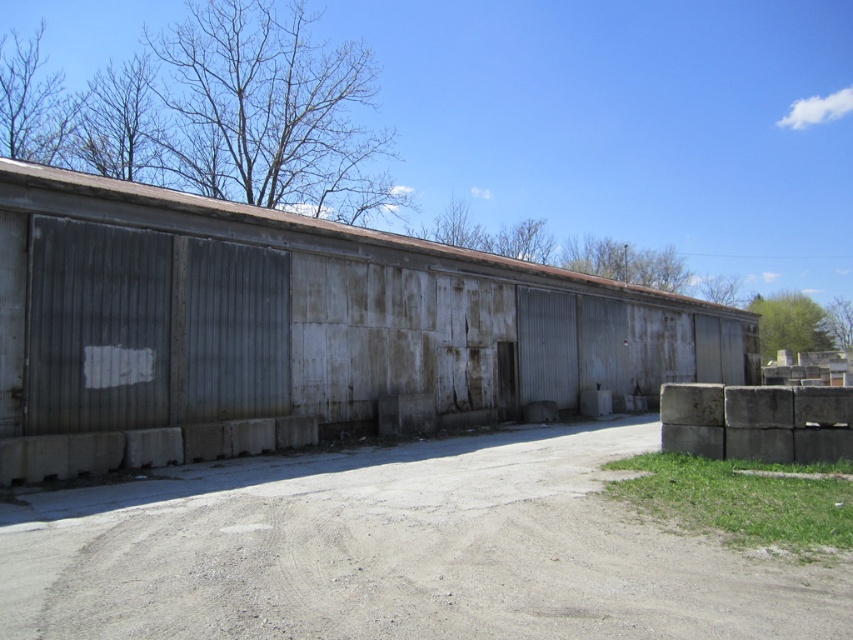
Question: Does rusty corrugated metal shed at center have a smaller size compared to gray gravel dirt track at center?

Choices:
 (A) no
 (B) yes

Answer: (A)

Question: Can you confirm if rusty corrugated metal shed at center is positioned below gray gravel dirt track at center?

Choices:
 (A) no
 (B) yes

Answer: (A)

Question: Is rusty corrugated metal shed at center further to camera compared to gray gravel dirt track at center?

Choices:
 (A) yes
 (B) no

Answer: (A)

Question: Which of the following is the closest to the observer?

Choices:
 (A) rusty corrugated metal shed at center
 (B) gray gravel dirt track at center

Answer: (B)